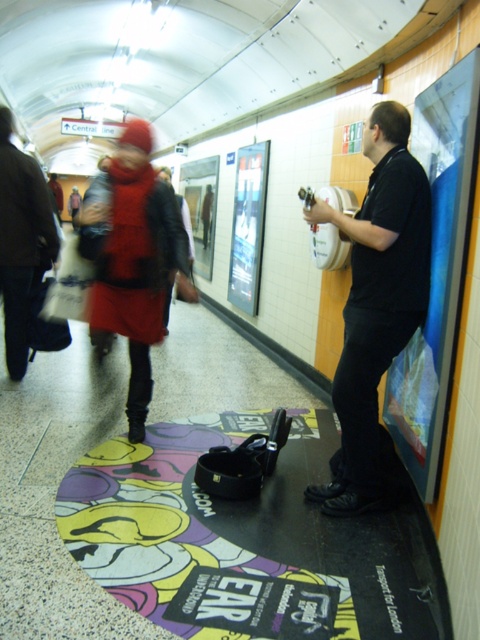
You are a delivery person who needs to place a rectangular package that is 1 meter tall. You see the matte plastic poster at right and the matte black coat at center. Which object can the package fit behind in terms of height?

The matte plastic poster at right is taller than the matte black coat at center, so the package can fit behind the matte plastic poster at right since it has sufficient height.

You are a delivery person carrying a package that is 3 feet long. You need to navigate through the subway station shown in the image. Can you fit through the space between the multicolored fabric mat at center and the velvet red coat at left without tilting the package?

The distance between the multicolored fabric mat at center and the velvet red coat at left is 3.56 feet. Since the package is 3 feet long, it can fit through the space as the available distance is greater than the package length.